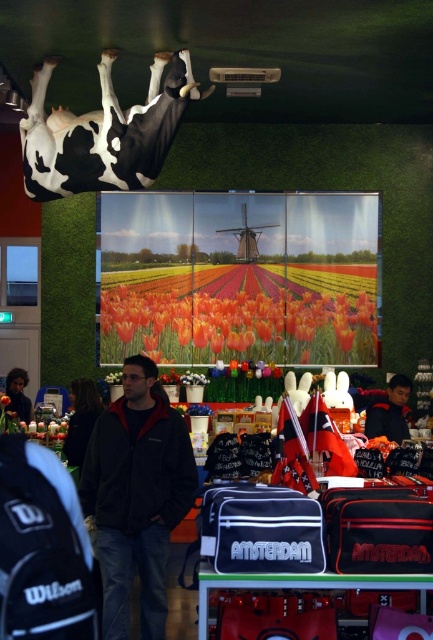
Which is below, dark gray fleece jacket at center or black and white cow at upper center?

dark gray fleece jacket at center

In order to click on dark gray fleece jacket at center in this screenshot , I will do `click(136, 497)`.

Is dark gray fleece jacket at center to the left of dark blue jacket at center from the viewer's perspective?

Yes, dark gray fleece jacket at center is to the left of dark blue jacket at center.

You are a GUI agent. You are given a task and a screenshot of the screen. Output one action in this format:
    pyautogui.click(x=<x>, y=<y>)
    Task: Click on the dark gray fleece jacket at center
    
    Given the screenshot: What is the action you would take?
    tap(136, 497)

Is dark gray fleece jacket at center wider than dark brown hair at lower left?

Yes.

Is dark gray fleece jacket at center further to the viewer compared to dark brown hair at lower left?

No, dark gray fleece jacket at center is closer to the viewer.

Between point (170, 465) and point (19, 396), which one is positioned behind?

Point (19, 396)

Locate an element on the screen. The width and height of the screenshot is (433, 640). dark gray fleece jacket at center is located at coordinates (136, 497).